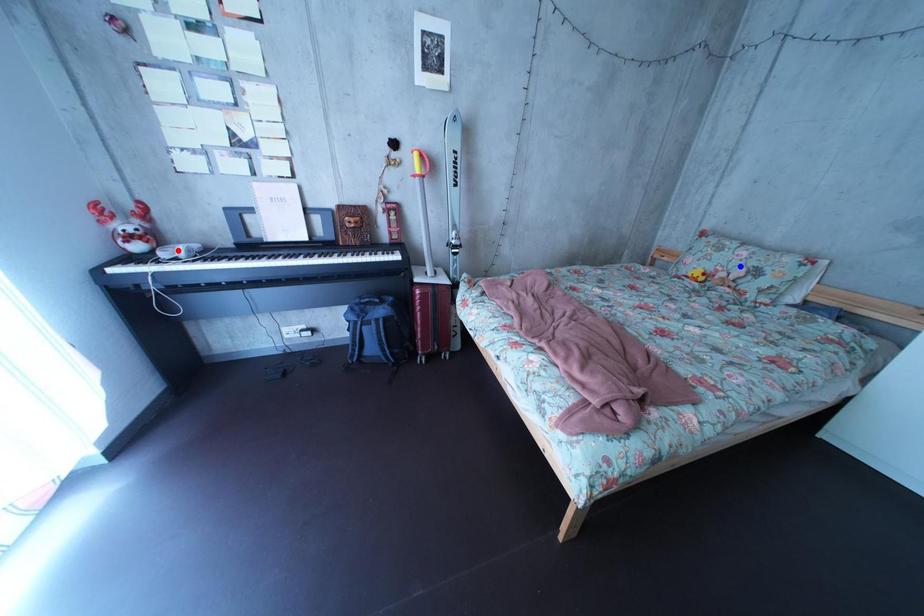
Question: Which of the two points in the image is closer to the camera?

Choices:
 (A) Blue point is closer.
 (B) Red point is closer.

Answer: (B)